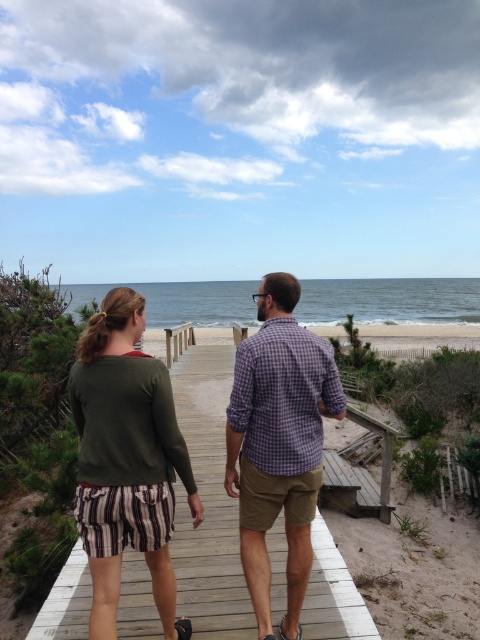
Question: Can you confirm if wooden boardwalk at center is positioned above green sweater at center?

Choices:
 (A) yes
 (B) no

Answer: (B)

Question: Is green sweater at center below purple checkered shirt at center?

Choices:
 (A) no
 (B) yes

Answer: (B)

Question: Which of the following is the closest to the observer?

Choices:
 (A) (180, 355)
 (B) (276, 330)
 (C) (130, 381)

Answer: (C)

Question: Which of the following is the farthest from the observer?

Choices:
 (A) green sweater at center
 (B) purple checkered shirt at center
 (C) wooden boardwalk at center

Answer: (C)

Question: Is wooden boardwalk at center smaller than green sweater at center?

Choices:
 (A) yes
 (B) no

Answer: (A)

Question: Among these points, which one is nearest to the camera?

Choices:
 (A) (70, 588)
 (B) (154, 484)

Answer: (B)